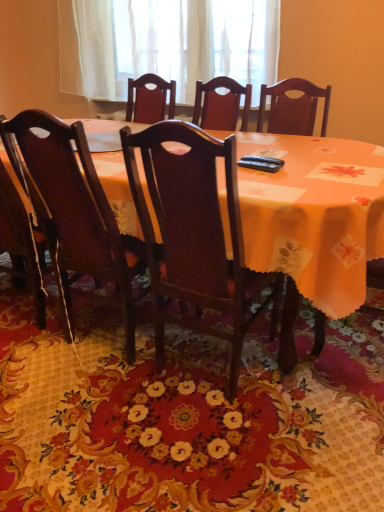
What do you see at coordinates (195, 234) in the screenshot?
I see `dark wood chair at center, the second chair from the left` at bounding box center [195, 234].

Find the location of a particular element. Image resolution: width=384 pixels, height=512 pixels. dark wood chair at center, placed as the 1th chair when sorted from right to left is located at coordinates (195, 234).

Describe the element at coordinates (186, 416) in the screenshot. I see `floral carpet at center` at that location.

Find the location of a particular element. The image size is (384, 512). orange fabric table at center is located at coordinates (313, 219).

Measure the distance between point (87, 262) and camera.

Point (87, 262) is 1.62 meters away from camera.

This screenshot has width=384, height=512. In order to click on dark wood chair at center, placed as the 1th chair when sorted from right to left in this screenshot , I will do `click(195, 234)`.

From a real-world perspective, is floral carpet at center on dark wood chair at center, placed as the 1th chair when sorted from right to left?

No.

Considering the sizes of floral carpet at center and dark wood chair at center, the second chair from the left, in the image, is floral carpet at center bigger or smaller than dark wood chair at center, the second chair from the left,?

Considering their sizes, floral carpet at center takes up less space than dark wood chair at center, the second chair from the left.

Which is more to the left, floral carpet at center or dark wood chair at center, placed as the 1th chair when sorted from right to left?

Result: floral carpet at center is more to the left.

Can dark wood chair at center, the second chair from the left, be found inside floral carpet at center?

No, dark wood chair at center, the second chair from the left, is not a part of floral carpet at center.

At what (x,y) coordinates should I click in order to perform the action: click on table on the left of dark wood chair at center, placed as the 1th chair when sorted from right to left. Please return your answer as a coordinate pair (x, y). The width and height of the screenshot is (384, 512). Looking at the image, I should click on (313, 219).

Based on the photo, is orange fabric table at center wider than dark wood chair at center, placed as the 1th chair when sorted from right to left?

Correct, the width of orange fabric table at center exceeds that of dark wood chair at center, placed as the 1th chair when sorted from right to left.

Considering the sizes of objects orange fabric table at center and dark wood chair at center, the second chair from the left, in the image provided, who is smaller, orange fabric table at center or dark wood chair at center, the second chair from the left,?

With smaller size is dark wood chair at center, the second chair from the left.

The width and height of the screenshot is (384, 512). I want to click on chair behind the dark wood chair at center, the second chair from the left, so click(x=76, y=210).

Which is nearer, [184,256] or [82,221]?

Point [184,256]

Could you tell me if dark wood chair at center, the second chair from the left, is facing wooden chair at center, the second chair in the right-to-left sequence?

No, dark wood chair at center, the second chair from the left, is not facing towards wooden chair at center, the second chair in the right-to-left sequence.

Is floral carpet at center surrounded by wooden chair at center, the second chair in the right-to-left sequence?

No, floral carpet at center is located outside of wooden chair at center, the second chair in the right-to-left sequence.

Who is smaller, wooden chair at center, acting as the first chair starting from the left, or floral carpet at center?

Smaller between the two is floral carpet at center.

Visually, is wooden chair at center, acting as the first chair starting from the left, positioned to the left or to the right of floral carpet at center?

In the image, wooden chair at center, acting as the first chair starting from the left, appears on the left side of floral carpet at center.

Is dark wood chair at center, placed as the 1th chair when sorted from right to left, positioned in front of floral carpet at center?

No, dark wood chair at center, placed as the 1th chair when sorted from right to left, is further to the viewer.

Considering the relative sizes of dark wood chair at center, placed as the 1th chair when sorted from right to left, and floral carpet at center in the image provided, is dark wood chair at center, placed as the 1th chair when sorted from right to left, wider than floral carpet at center?

Incorrect, the width of dark wood chair at center, placed as the 1th chair when sorted from right to left, does not surpass that of floral carpet at center.

From the image's perspective, which is above, dark wood chair at center, the second chair from the left, or floral carpet at center?

dark wood chair at center, the second chair from the left, is shown above in the image.

Is dark wood chair at center, placed as the 1th chair when sorted from right to left, located outside floral carpet at center?

That's correct, dark wood chair at center, placed as the 1th chair when sorted from right to left, is outside of floral carpet at center.

Is wooden chair at center, the second chair in the right-to-left sequence, touching orange fabric table at center?

They are not placed beside each other.

What's the angular difference between wooden chair at center, acting as the first chair starting from the left, and orange fabric table at center's facing directions?

The angle between the facing direction of wooden chair at center, acting as the first chair starting from the left, and the facing direction of orange fabric table at center is 180 degrees.

Can you confirm if wooden chair at center, the second chair in the right-to-left sequence, is positioned to the right of orange fabric table at center?

No.

Based on the photo, which object is closer to the camera, wooden chair at center, the second chair in the right-to-left sequence, or orange fabric table at center?

orange fabric table at center is more forward.

Is point (207, 161) positioned behind point (256, 72)?

No.

Which is more to the left, dark wood chair at center, the second chair from the left, or white sheer curtain at upper center?

white sheer curtain at upper center.

Is dark wood chair at center, the second chair from the left, smaller than white sheer curtain at upper center?

Actually, dark wood chair at center, the second chair from the left, might be larger than white sheer curtain at upper center.

Where is `mat below the dark wood chair at center, the second chair from the left (from a real-world perspective)`? This screenshot has height=512, width=384. mat below the dark wood chair at center, the second chair from the left (from a real-world perspective) is located at coordinates (186, 416).

Find the location of `chair on the right of orange fabric table at center`. chair on the right of orange fabric table at center is located at coordinates (195, 234).

Based on the photo, which object lies nearer to the anchor point floral carpet at center, orange fabric table at center or white sheer curtain at upper center?

Based on the image, orange fabric table at center appears to be nearer to floral carpet at center.

Looking at this image, looking at the image, which one is located closer to wooden chair at center, the second chair in the right-to-left sequence, white sheer curtain at upper center or dark wood chair at center, the second chair from the left?

dark wood chair at center, the second chair from the left, is positioned closer to the anchor wooden chair at center, the second chair in the right-to-left sequence.

Estimate the real-world distances between objects in this image. Which object is further from white sheer curtain at upper center, wooden chair at center, acting as the first chair starting from the left, or floral carpet at center?

floral carpet at center is positioned further to the anchor white sheer curtain at upper center.

Considering their positions, is wooden chair at center, acting as the first chair starting from the left, positioned closer to dark wood chair at center, the second chair from the left, than white sheer curtain at upper center?

Among the two, wooden chair at center, acting as the first chair starting from the left, is located nearer to dark wood chair at center, the second chair from the left.

In the scene shown: From the image, which object appears to be farther from wooden chair at center, the second chair in the right-to-left sequence, floral carpet at center or white sheer curtain at upper center?

Among the two, white sheer curtain at upper center is located further to wooden chair at center, the second chair in the right-to-left sequence.

In the scene shown: When comparing their distances from white sheer curtain at upper center, does dark wood chair at center, placed as the 1th chair when sorted from right to left, or wooden chair at center, acting as the first chair starting from the left, seem closer?

Based on the image, wooden chair at center, acting as the first chair starting from the left, appears to be nearer to white sheer curtain at upper center.

Based on the photo, based on their spatial positions, is white sheer curtain at upper center or floral carpet at center further from orange fabric table at center?

Among the two, white sheer curtain at upper center is located further to orange fabric table at center.

Considering their positions, is orange fabric table at center positioned further to dark wood chair at center, placed as the 1th chair when sorted from right to left, than floral carpet at center?

floral carpet at center.

Identify the location of chair that lies between wooden chair at center, acting as the first chair starting from the left, and floral carpet at center from top to bottom. (195, 234).

Image resolution: width=384 pixels, height=512 pixels. I want to click on table that lies between white sheer curtain at upper center and wooden chair at center, the second chair in the right-to-left sequence, from top to bottom, so pyautogui.click(x=313, y=219).

Identify the location of chair between white sheer curtain at upper center and dark wood chair at center, placed as the 1th chair when sorted from right to left, vertically. click(76, 210).

Where is `table situated between wooden chair at center, acting as the first chair starting from the left, and dark wood chair at center, the second chair from the left, from left to right`? table situated between wooden chair at center, acting as the first chair starting from the left, and dark wood chair at center, the second chair from the left, from left to right is located at coordinates (313, 219).